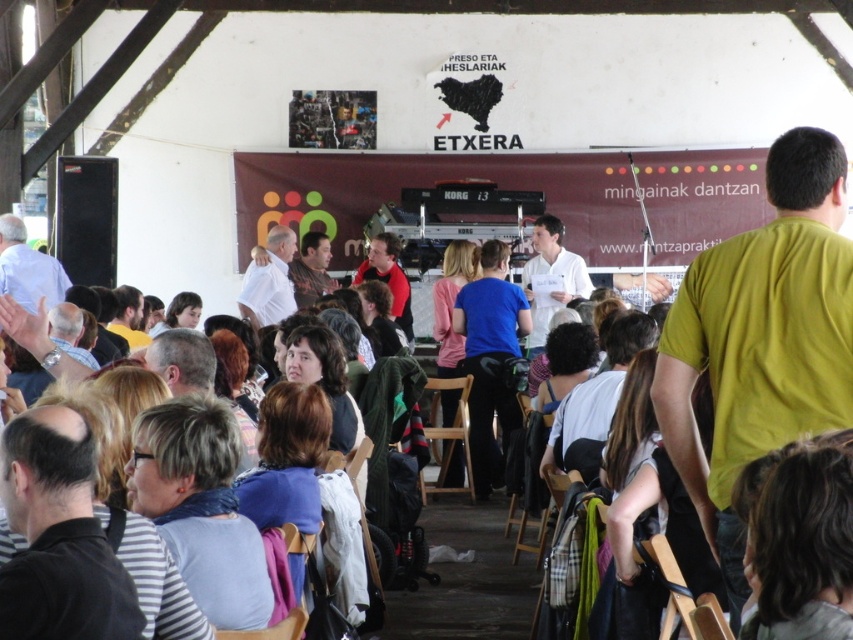
Between point (830, 310) and point (428, 381), which one is positioned in front?

Positioned in front is point (830, 310).

Who is shorter, green t-shirt at right or wooden chair at center?

wooden chair at center

Between point (779, 192) and point (463, 403), which one is positioned in front?

Point (779, 192) is in front.

At what (x,y) coordinates should I click in order to perform the action: click on green t-shirt at right. Please return your answer as a coordinate pair (x, y). The image size is (853, 640). Looking at the image, I should click on (761, 339).

Is point (706, 525) more distant than point (463, 339)?

No, it is not.

Is point (728, 577) more distant than point (463, 305)?

No, (728, 577) is closer to viewer.

Find the location of a particular element. green t-shirt at right is located at coordinates (761, 339).

Does blue matte shirt at center appear under wooden chair at center?

No, blue matte shirt at center is not below wooden chair at center.

Which is behind, point (518, 355) or point (457, 410)?

The point (518, 355) is behind.

Where is `blue matte shirt at center`? This screenshot has height=640, width=853. blue matte shirt at center is located at coordinates (490, 356).